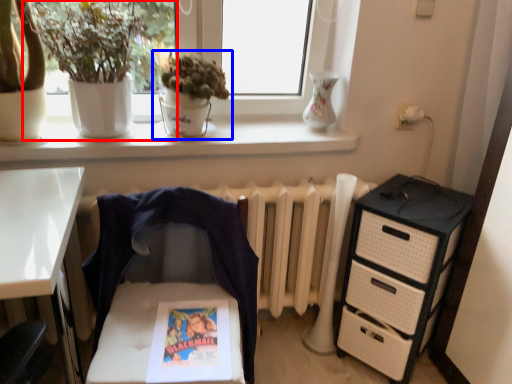
Question: Among these objects, which one is farthest to the camera, houseplant (highlighted by a red box) or houseplant (highlighted by a blue box)?

Choices:
 (A) houseplant
 (B) houseplant

Answer: (B)